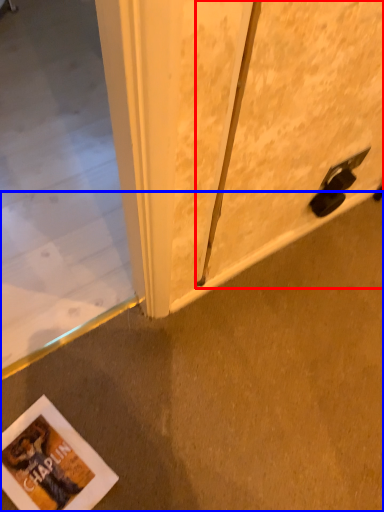
Question: Which object appears farthest to the camera in this image, screen door (highlighted by a red box) or concrete (highlighted by a blue box)?

Choices:
 (A) screen door
 (B) concrete

Answer: (B)